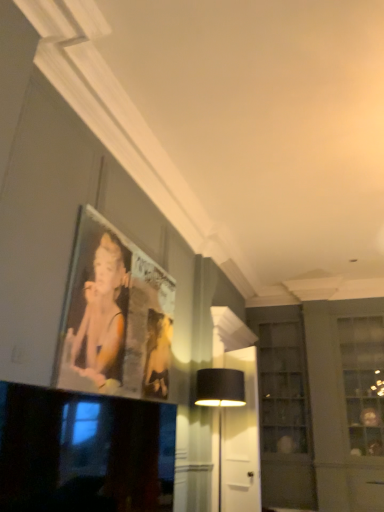
Image resolution: width=384 pixels, height=512 pixels. What are the coordinates of `metallic silver picture frame at upper left` in the screenshot? It's located at (114, 316).

What do you see at coordinates (84, 452) in the screenshot? I see `black glossy television at lower left` at bounding box center [84, 452].

Identify the location of black fabric table lamp at center. The image size is (384, 512). (220, 401).

You are a GUI agent. You are given a task and a screenshot of the screen. Output one action in this format:
    pyautogui.click(x=<x>, y=<y>)
    Task: Click on the metallic silver picture frame at upper left
    
    Given the screenshot: What is the action you would take?
    pyautogui.click(x=114, y=316)

Which is correct: clear glass cabinet at center right is inside black fabric table lamp at center, or outside of it?

clear glass cabinet at center right is not inside black fabric table lamp at center, it's outside.

Is clear glass cabinet at center right facing towards black fabric table lamp at center?

Yes, clear glass cabinet at center right is facing black fabric table lamp at center.

Visually, is clear glass cabinet at center right positioned to the left or to the right of black fabric table lamp at center?

In the image, clear glass cabinet at center right appears on the right side of black fabric table lamp at center.

From the image's perspective, which is above, clear glass cabinet at center right or black fabric table lamp at center?

black fabric table lamp at center appears higher in the image.

Does point (219, 454) come behind point (103, 489)?

Yes, point (219, 454) is farther from viewer.

Is black fabric table lamp at center to the right of black glossy television at lower left from the viewer's perspective?

Indeed, black fabric table lamp at center is positioned on the right side of black glossy television at lower left.

From the image's perspective, does black fabric table lamp at center appear higher than black glossy television at lower left?

No, from the image's perspective, black fabric table lamp at center is not over black glossy television at lower left.

From the image's perspective, which is above, black glossy television at lower left or black fabric table lamp at center?

black glossy television at lower left appears higher in the image.

From a real-world perspective, is black glossy television at lower left beneath black fabric table lamp at center?

Yes, from a real-world perspective, black glossy television at lower left is below black fabric table lamp at center.

Based on the photo, how much distance is there between black glossy television at lower left and black fabric table lamp at center?

A distance of 7.22 feet exists between black glossy television at lower left and black fabric table lamp at center.

Between point (4, 455) and point (205, 398), which one is positioned in front?

The point (4, 455) is in front.

Which is behind, point (93, 449) or point (274, 386)?

Point (274, 386)

Which object is closer to the camera taking this photo, black glossy television at lower left or clear glass cabinet at center right?

black glossy television at lower left is more forward.

From a real-world perspective, does black glossy television at lower left sit lower than clear glass cabinet at center right?

Yes, from a real-world perspective, black glossy television at lower left is below clear glass cabinet at center right.

Consider the image. Considering the positions of objects black glossy television at lower left and clear glass cabinet at center right in the image provided, who is more to the left, black glossy television at lower left or clear glass cabinet at center right?

From the viewer's perspective, black glossy television at lower left appears more on the left side.

Is black fabric table lamp at center inside or outside of metallic silver picture frame at upper left?

black fabric table lamp at center is spatially situated outside metallic silver picture frame at upper left.

Which is further, (234,384) or (171,298)?

Point (171,298)

Is black fabric table lamp at center facing towards metallic silver picture frame at upper left?

No.

Considering the sizes of black fabric table lamp at center and metallic silver picture frame at upper left in the image, is black fabric table lamp at center taller or shorter than metallic silver picture frame at upper left?

Considering their sizes, black fabric table lamp at center has more height than metallic silver picture frame at upper left.

Is black glossy television at lower left positioned beyond the bounds of metallic silver picture frame at upper left?

Yes, black glossy television at lower left is outside of metallic silver picture frame at upper left.

Between black glossy television at lower left and metallic silver picture frame at upper left, which one has larger size?

metallic silver picture frame at upper left is bigger.

Is metallic silver picture frame at upper left at the back of black glossy television at lower left?

No, metallic silver picture frame at upper left is not at the back of black glossy television at lower left.

Measure the distance between black glossy television at lower left and metallic silver picture frame at upper left.

black glossy television at lower left is 37.59 inches from metallic silver picture frame at upper left.

Is metallic silver picture frame at upper left smaller than black glossy television at lower left?

No, metallic silver picture frame at upper left is not smaller than black glossy television at lower left.

Is metallic silver picture frame at upper left looking in the opposite direction of black glossy television at lower left?

metallic silver picture frame at upper left does not have its back to black glossy television at lower left.

Does metallic silver picture frame at upper left have a lesser height compared to black glossy television at lower left?

No.

The width and height of the screenshot is (384, 512). In order to click on glass door that is below the black fabric table lamp at center (from the image's perspective) in this screenshot , I will do `click(284, 413)`.

The width and height of the screenshot is (384, 512). Find the location of `television below the black fabric table lamp at center (from a real-world perspective)`. television below the black fabric table lamp at center (from a real-world perspective) is located at coordinates (84, 452).

Estimate the real-world distances between objects in this image. Which object is closer to black glossy television at lower left, metallic silver picture frame at upper left or black fabric table lamp at center?

metallic silver picture frame at upper left is closer to black glossy television at lower left.

Which object lies nearer to the anchor point clear glass cabinet at center right, black glossy television at lower left or black fabric table lamp at center?

Among the two, black fabric table lamp at center is located nearer to clear glass cabinet at center right.

Considering their positions, is black glossy television at lower left positioned further to metallic silver picture frame at upper left than black fabric table lamp at center?

black fabric table lamp at center is further to metallic silver picture frame at upper left.

Looking at this image, looking at the image, which one is located further to metallic silver picture frame at upper left, clear glass cabinet at center right or black fabric table lamp at center?

clear glass cabinet at center right lies further to metallic silver picture frame at upper left than the other object.

Which object lies nearer to the anchor point black glossy television at lower left, black fabric table lamp at center or metallic silver picture frame at upper left?

metallic silver picture frame at upper left is positioned closer to the anchor black glossy television at lower left.

Looking at the image, which one is located closer to clear glass cabinet at center right, black fabric table lamp at center or black glossy television at lower left?

Based on the image, black fabric table lamp at center appears to be nearer to clear glass cabinet at center right.

From the image, which object appears to be nearer to metallic silver picture frame at upper left, black glossy television at lower left or clear glass cabinet at center right?

black glossy television at lower left.

Estimate the real-world distances between objects in this image. Which object is further from black fabric table lamp at center, black glossy television at lower left or clear glass cabinet at center right?

Based on the image, black glossy television at lower left appears to be further to black fabric table lamp at center.

Where is `picture frame between black glossy television at lower left and black fabric table lamp at center from front to back`? Image resolution: width=384 pixels, height=512 pixels. picture frame between black glossy television at lower left and black fabric table lamp at center from front to back is located at coordinates pos(114,316).

Locate an element on the screen. table lamp between black glossy television at lower left and clear glass cabinet at center right in the front-back direction is located at coordinates (220, 401).

This screenshot has height=512, width=384. In order to click on table lamp positioned between metallic silver picture frame at upper left and clear glass cabinet at center right from near to far in this screenshot , I will do `click(220, 401)`.

What are the coordinates of `picture frame located between black glossy television at lower left and clear glass cabinet at center right in the depth direction` in the screenshot? It's located at (114, 316).